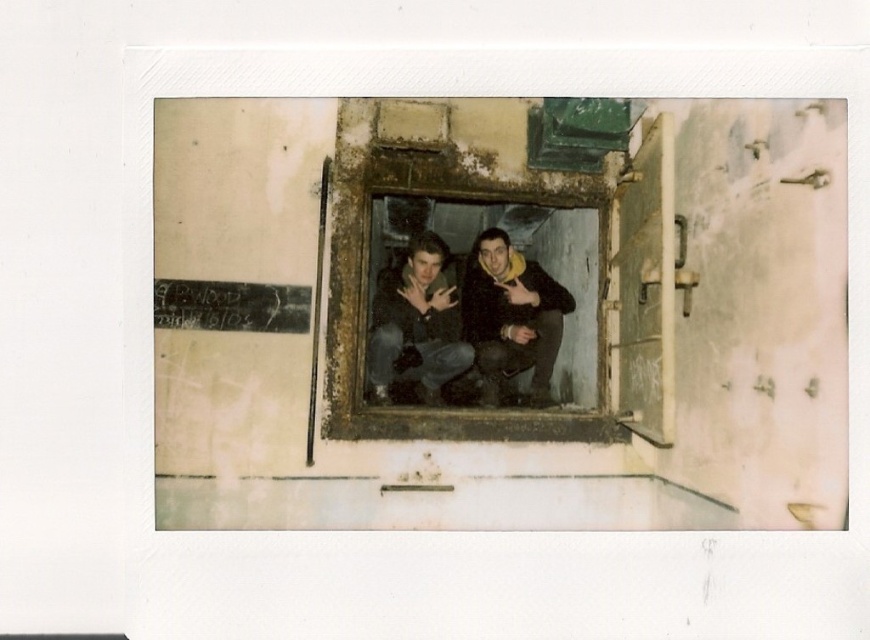
Is point (393, 358) positioned before point (382, 397)?

That is False.

Between dark blue jeans at center and dark gray jeans at center, which one is positioned higher?

Positioned higher is dark blue jeans at center.

Is point (485, 404) positioned after point (403, 346)?

Yes, point (485, 404) is behind point (403, 346).

You are a GUI agent. You are given a task and a screenshot of the screen. Output one action in this format:
    pyautogui.click(x=<x>, y=<y>)
    Task: Click on the dark blue jeans at center
    The height and width of the screenshot is (640, 870).
    Given the screenshot: What is the action you would take?
    pyautogui.click(x=469, y=321)